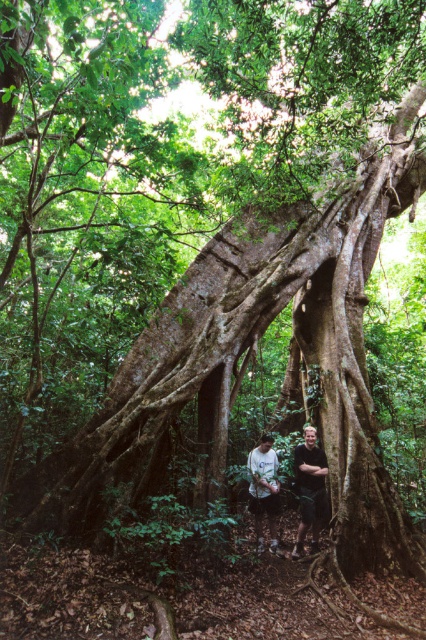
Based on the photo, does white t-shirt at center come behind dark green t-shirt at center?

No, it is not.

Locate an element on the screen. white t-shirt at center is located at coordinates (310, 490).

This screenshot has width=426, height=640. What do you see at coordinates (310, 490) in the screenshot?
I see `white t-shirt at center` at bounding box center [310, 490].

Identify the location of white t-shirt at center. The height and width of the screenshot is (640, 426). (310, 490).

Who is more distant from viewer, [301,532] or [259,460]?

The point [259,460] is more distant.

Does dark green t-shirt at center have a smaller size compared to white matte shirt at center?

Correct, dark green t-shirt at center occupies less space than white matte shirt at center.

I want to click on dark green t-shirt at center, so click(310, 490).

You are a GUI agent. You are given a task and a screenshot of the screen. Output one action in this format:
    pyautogui.click(x=<x>, y=<y>)
    Task: Click on the dark green t-shirt at center
    This screenshot has height=640, width=426.
    Given the screenshot: What is the action you would take?
    [x=310, y=490]

Between white t-shirt at center and white matte shirt at center, which one has less height?

Standing shorter between the two is white matte shirt at center.

Who is higher up, white t-shirt at center or white matte shirt at center?

white matte shirt at center is higher up.

Which is in front, point (316, 468) or point (267, 468)?

Point (267, 468) is in front.

I want to click on white t-shirt at center, so click(310, 490).